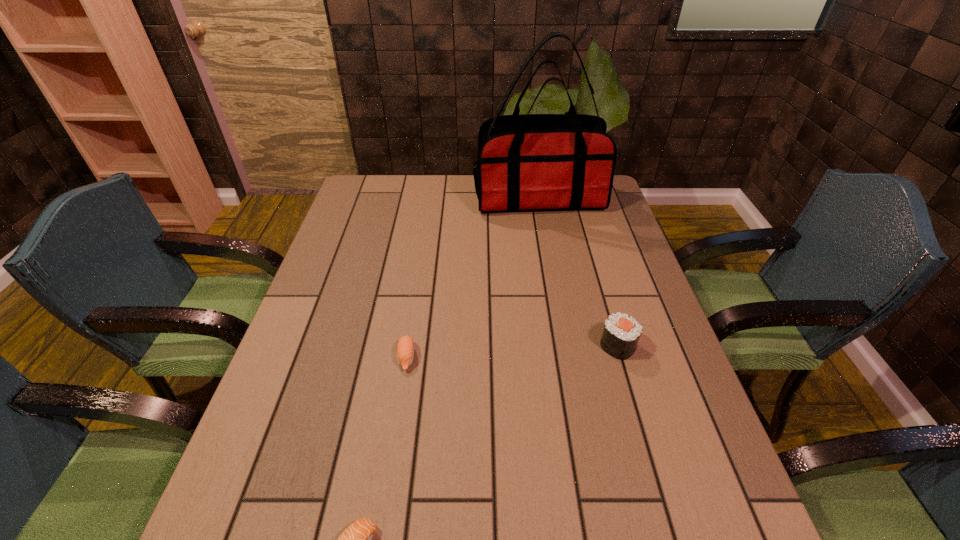
The height and width of the screenshot is (540, 960). I want to click on sushi at the right edge, so click(x=621, y=334).

Locate an element on the screen. object located in the far right corner section of the desktop is located at coordinates (532, 161).

Image resolution: width=960 pixels, height=540 pixels. In the image, there is a desktop. Identify the location of vacant space at the far edge. (420, 191).

Where is `vacant space at the left edge of the desktop`? vacant space at the left edge of the desktop is located at coordinates (317, 325).

This screenshot has width=960, height=540. Identify the location of vacant space at the right edge of the desktop. (622, 243).

Image resolution: width=960 pixels, height=540 pixels. Find the location of `vacant area between the second tallest object and the third tallest object`. vacant area between the second tallest object and the third tallest object is located at coordinates (512, 352).

Find the location of a particular element. blank region between the rightmost sushi and the second shortest sushi is located at coordinates (512, 352).

The width and height of the screenshot is (960, 540). Identify the location of free spot between the farthest object and the third tallest object. (472, 278).

Locate an element on the screen. The width and height of the screenshot is (960, 540). vacant point located between the third shortest object and the second shortest object is located at coordinates (512, 352).

You are a GUI agent. You are given a task and a screenshot of the screen. Output one action in this format:
    pyautogui.click(x=<x>, y=<y>)
    Task: Click on the vacant region between the rightmost sushi and the duffel bag
    
    Given the screenshot: What is the action you would take?
    pyautogui.click(x=578, y=272)